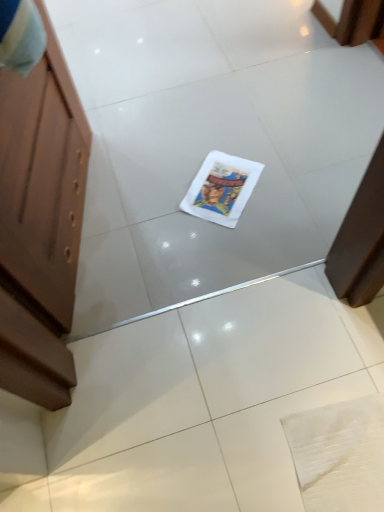
The image size is (384, 512). What are the coordinates of `vacant space behind white paper comic book at center` in the screenshot? It's located at (218, 139).